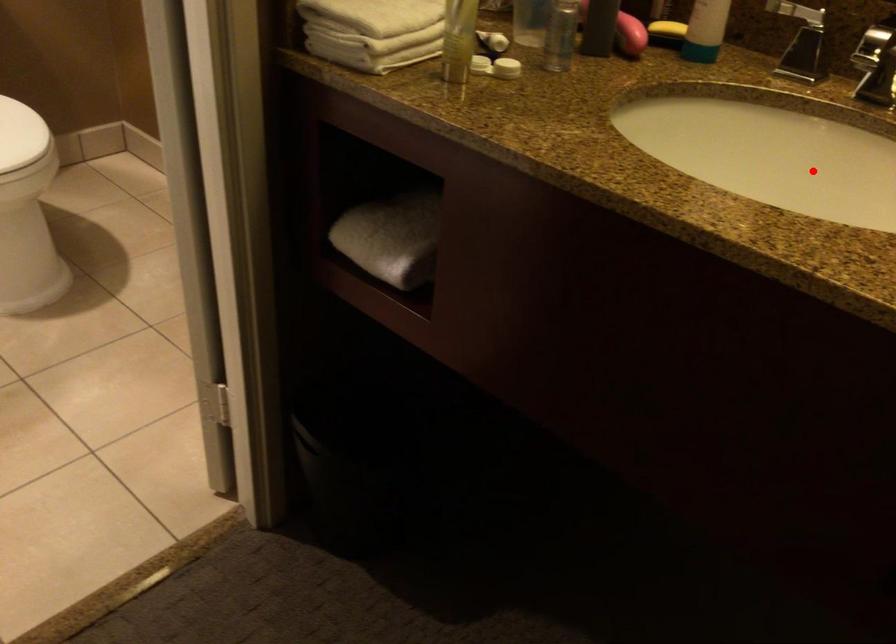
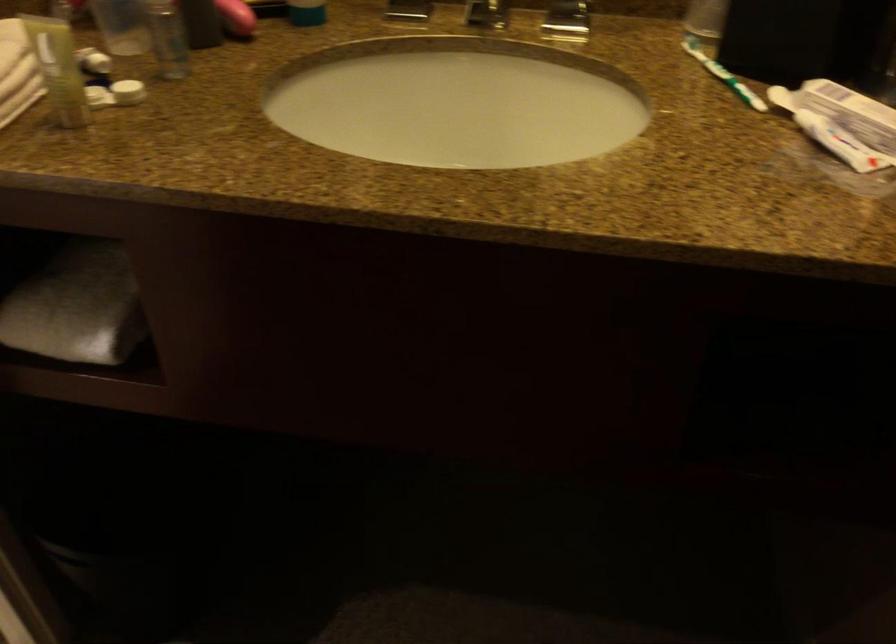
The point at the highlighted location is marked in the first image. Where is the corresponding point in the second image?

(457, 102)